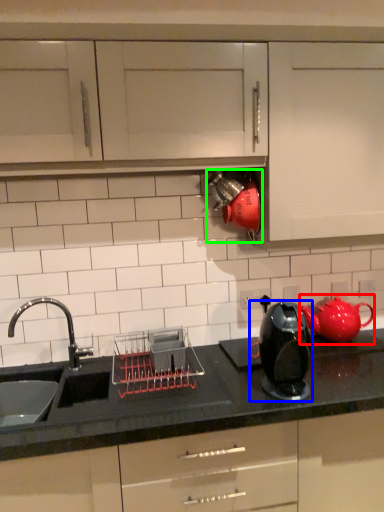
Question: Which object is positioned farthest from tea pot (highlighted by a red box)? Select from home appliance (highlighted by a blue box) and appliance (highlighted by a green box).

Choices:
 (A) home appliance
 (B) appliance

Answer: (B)